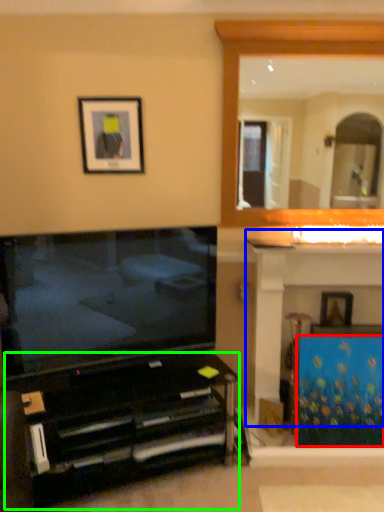
Question: Based on their relative distances, which object is farther from curtain (highlighted by a red box)? Choose from dresser (highlighted by a blue box) and furniture (highlighted by a green box).

Choices:
 (A) dresser
 (B) furniture

Answer: (B)